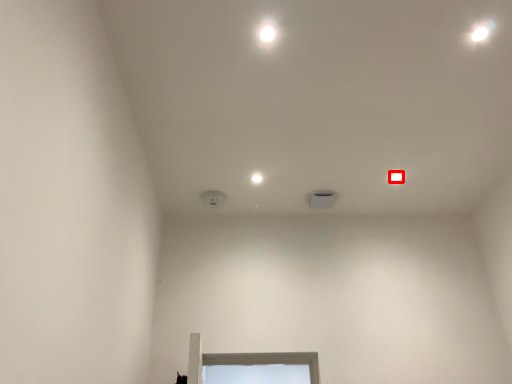
Question: From the image's perspective, considering the relative positions of dot (annotated by the red box) and dot in the image provided, where is dot (annotated by the red box) located with respect to the staircase?

Choices:
 (A) above
 (B) below

Answer: (A)